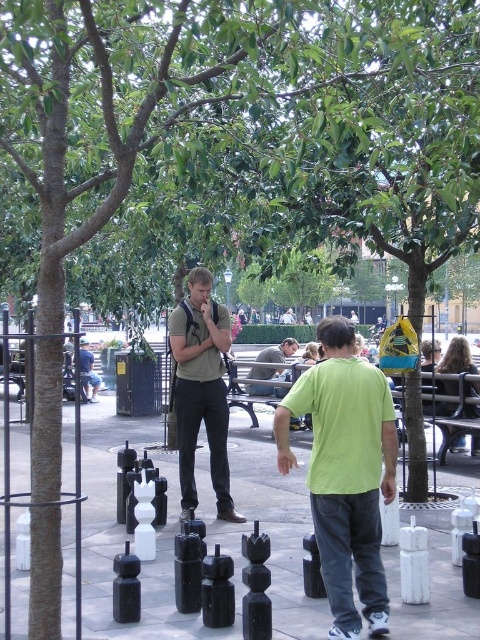
You are standing at the point marked as point (345, 472) in the image. What is the color of the clothing item you are currently standing on?

The point (345, 472) is located on the light green tshirt at center, so the color of the clothing item you are currently standing on is light green.

You are standing in the park and see two points marked in the scene. Which point is closer to you, point (106, 465) or point (220, 400)?

Point (220, 400) is closer to you because it is less further away than point (106, 465).

You are standing at the point labeled point (92, 372) and want to walk to the point labeled point (361, 376). Which direction should you move in to reach your destination?

You should move forward because point (361, 376) is in front of point (92, 372).